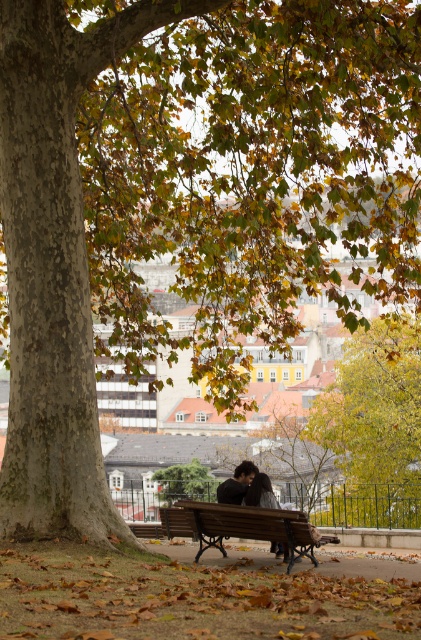
Is dark brown leather coat at center to the left of dark brown leather jacket at center from the viewer's perspective?

No, dark brown leather coat at center is not to the left of dark brown leather jacket at center.

Looking at this image, which of these two, dark brown leather coat at center or dark brown leather jacket at center, stands taller?

With more height is dark brown leather coat at center.

Which is in front, point (255, 483) or point (220, 490)?

Positioned in front is point (255, 483).

Locate an element on the screen. This screenshot has width=421, height=640. dark brown leather coat at center is located at coordinates (261, 492).

Is point (191, 465) behind point (252, 474)?

Yes, point (191, 465) is behind point (252, 474).

Who is lower down, green leafy tree at center or dark brown leather jacket at center?

Positioned lower is green leafy tree at center.

Who is more distant from viewer, (164, 492) or (239, 470)?

Positioned behind is point (164, 492).

What are the coordinates of `green leafy tree at center` in the screenshot? It's located at (184, 483).

Can you confirm if yellow-green foliage at center is positioned to the right of wooden bench at center?

Correct, you'll find yellow-green foliage at center to the right of wooden bench at center.

Does yellow-green foliage at center have a lesser width compared to wooden bench at center?

No.

Find the location of a particular element. yellow-green foliage at center is located at coordinates (373, 426).